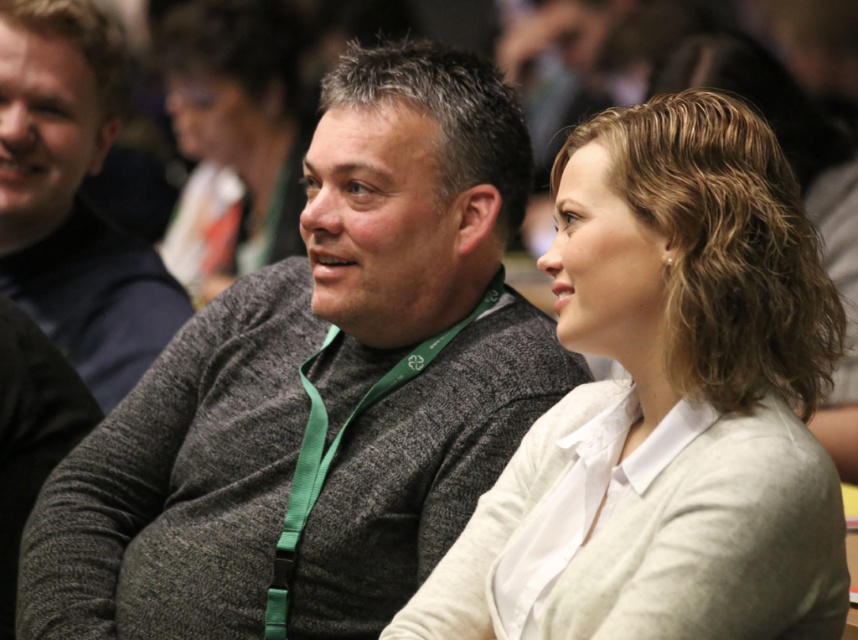
Question: Which point is closer to the camera taking this photo?

Choices:
 (A) coord(626,124)
 (B) coord(421,275)
 (C) coord(92,364)
 (D) coord(239,272)

Answer: (A)

Question: Does gray knit sweater at center appear under light beige sweater at center?

Choices:
 (A) no
 (B) yes

Answer: (B)

Question: Does gray knit sweater at center appear over light beige sweater at center?

Choices:
 (A) yes
 (B) no

Answer: (B)

Question: Is dark gray sweater at center positioned in front of matte black hair at upper center?

Choices:
 (A) yes
 (B) no

Answer: (A)

Question: Considering the real-world distances, which object is farthest from the matte black hair at upper center?

Choices:
 (A) dark gray sweater at center
 (B) gray knit sweater at center

Answer: (B)

Question: Which object appears farthest from the camera in this image?

Choices:
 (A) light beige sweater at center
 (B) dark gray sweater at center

Answer: (B)